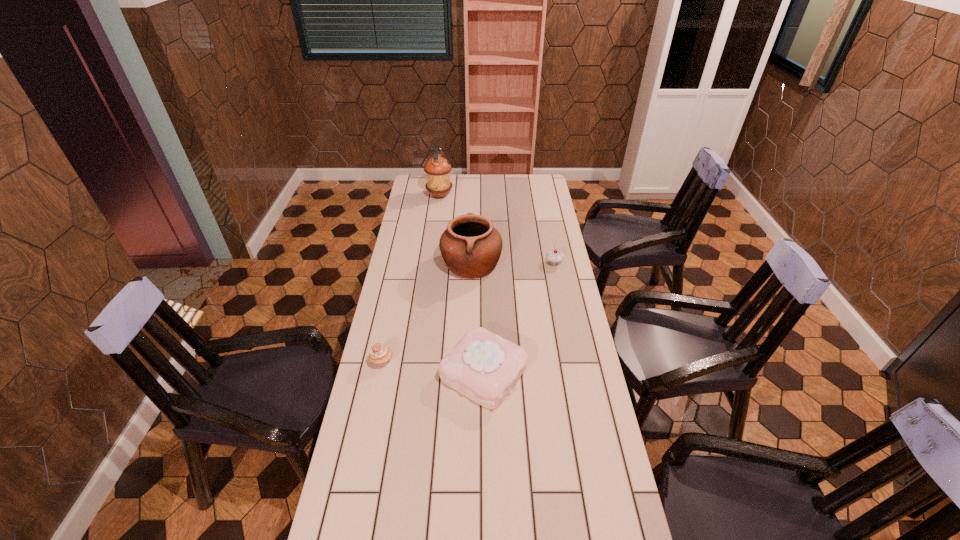
Where is `vacant area situated on the front of the farther cupcake`? vacant area situated on the front of the farther cupcake is located at coordinates (563, 305).

Identify the location of free point located 0.120m on the front of the cake. (485, 449).

Identify the location of free spot located 0.100m on the right of the nearer cupcake. (422, 361).

The image size is (960, 540). What are the coordinates of `object that is at the far edge` in the screenshot? It's located at (437, 168).

Locate an element on the screen. oil lamp present at the left edge is located at coordinates (437, 168).

This screenshot has width=960, height=540. I want to click on cupcake located at the left edge, so 380,355.

You are a GUI agent. You are given a task and a screenshot of the screen. Output one action in this format:
    pyautogui.click(x=<x>, y=<y>)
    Task: Click on the object located in the right edge section of the desktop
    The width and height of the screenshot is (960, 540).
    Given the screenshot: What is the action you would take?
    pyautogui.click(x=554, y=257)

Identify the location of object present at the far left corner. (437, 168).

Where is `free space at the far edge of the desktop`? This screenshot has height=540, width=960. free space at the far edge of the desktop is located at coordinates (507, 197).

This screenshot has width=960, height=540. What are the coordinates of `vacant region at the left edge of the desktop` in the screenshot? It's located at (411, 202).